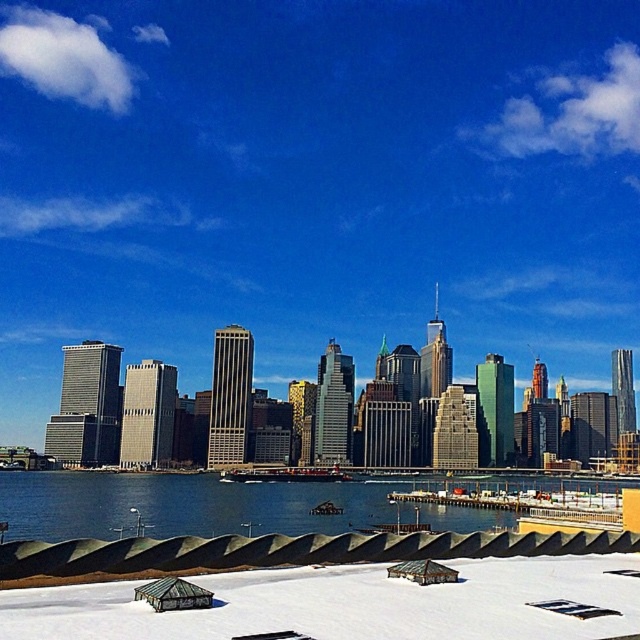
Can you confirm if white matte snow at lower center is positioned to the right of blue water at lower center?

Correct, you'll find white matte snow at lower center to the right of blue water at lower center.

Between white matte snow at lower center and blue water at lower center, which one has less height?

white matte snow at lower center is shorter.

Image resolution: width=640 pixels, height=640 pixels. Find the location of `white matte snow at lower center`. white matte snow at lower center is located at coordinates (353, 604).

At what (x,y) coordinates should I click in order to perform the action: click on white matte snow at lower center. Please return your answer as a coordinate pair (x, y). The width and height of the screenshot is (640, 640). Looking at the image, I should click on (353, 604).